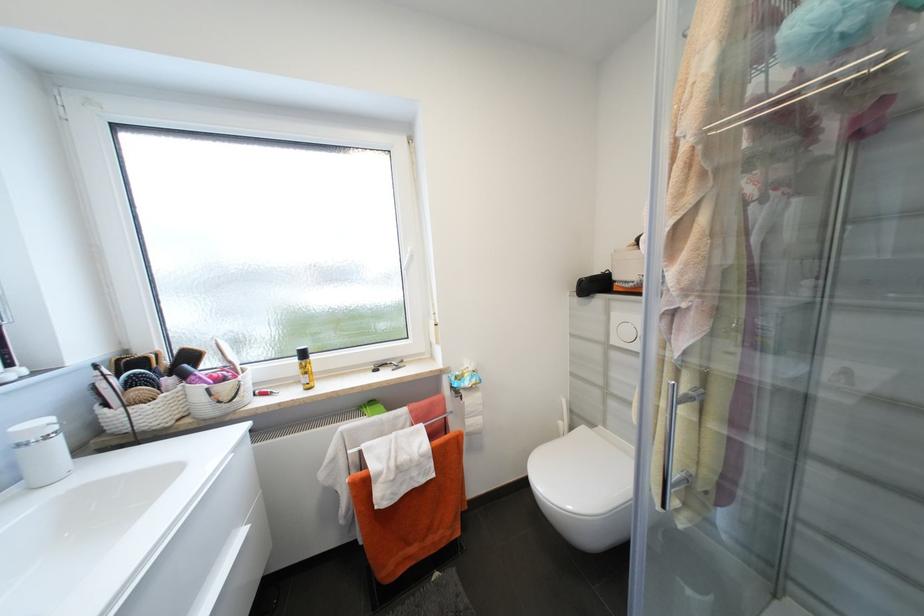
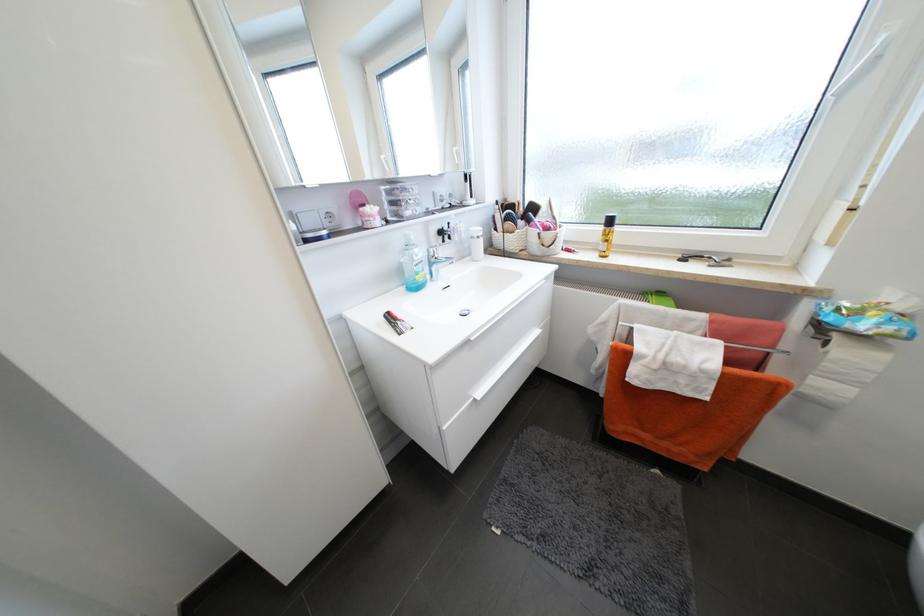
Locate, in the second image, the point that corresponds to pixel 307 390 in the first image.

(602, 256)